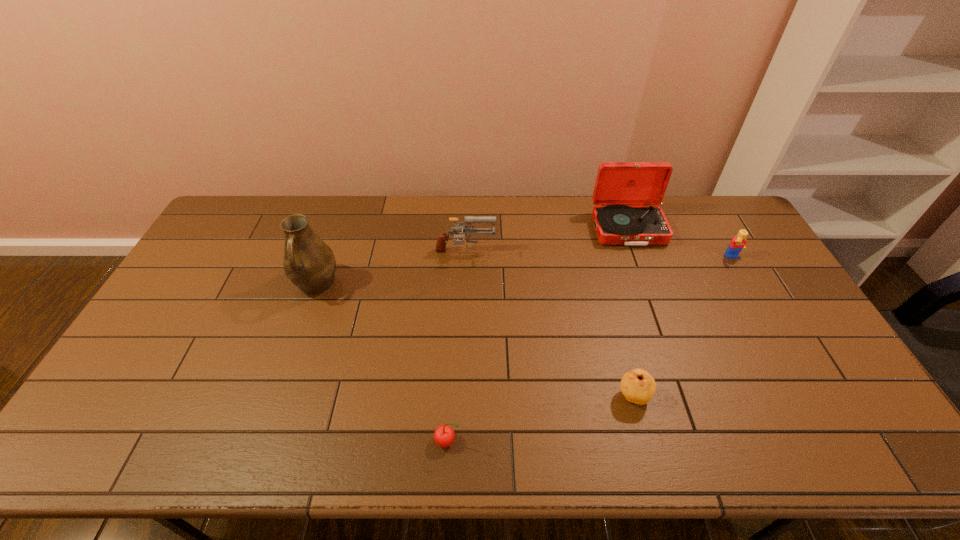
Where is `pitcher`? pitcher is located at coordinates (309, 263).

This screenshot has height=540, width=960. Find the location of `phonograph_record`. phonograph_record is located at coordinates (626, 194).

At what (x,y) coordinates should I click in order to perform the action: click on the fourth shortest object. Please return your answer as a coordinate pair (x, y). The width and height of the screenshot is (960, 540). Looking at the image, I should click on (443, 238).

In order to click on the rightmost object in this screenshot , I will do click(738, 243).

You are a GUI agent. You are given a task and a screenshot of the screen. Output one action in this format:
    pyautogui.click(x=<x>, y=<y>)
    Task: Click on the fifth farthest object
    The height and width of the screenshot is (540, 960).
    Given the screenshot: What is the action you would take?
    pyautogui.click(x=638, y=386)

At what (x,y) coordinates should I click in order to perform the action: click on cherry. Please return your answer as a coordinate pair (x, y). Looking at the image, I should click on (444, 435).

Find the location of a particular element. vacant space located on the handle side of the leftmost object is located at coordinates (276, 399).

This screenshot has width=960, height=540. I want to click on blank area located 0.090m on the front-facing side of the phonograph_record, so click(x=641, y=267).

You are a GUI agent. You are given a task and a screenshot of the screen. Output one action in this format:
    pyautogui.click(x=<x>, y=<y>)
    Task: Click on the free region located at the barrel end of the third tallest object
    
    Given the screenshot: What is the action you would take?
    pyautogui.click(x=598, y=254)

Where is `vacant space situated 0.140m on the face of the rightmost object`? This screenshot has height=540, width=960. vacant space situated 0.140m on the face of the rightmost object is located at coordinates (754, 294).